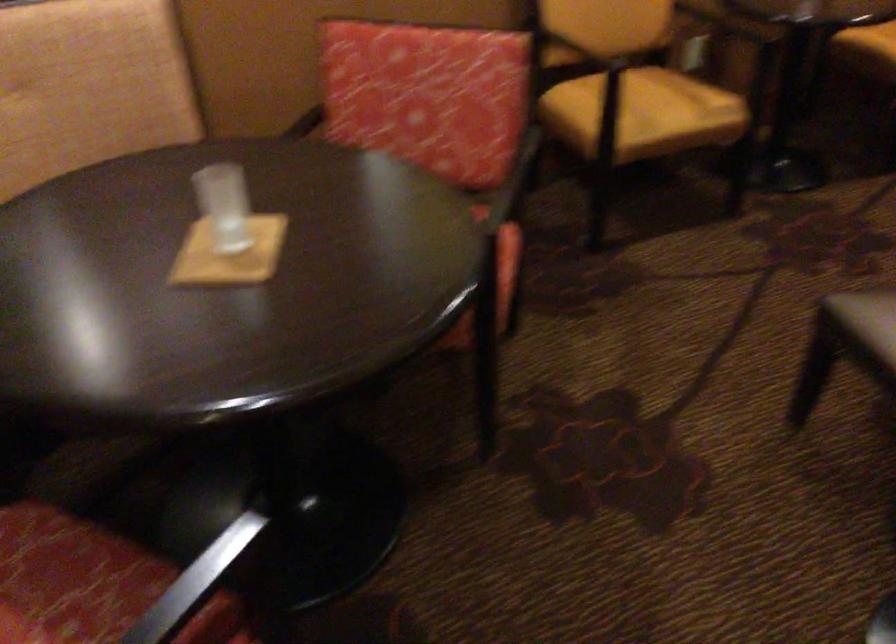
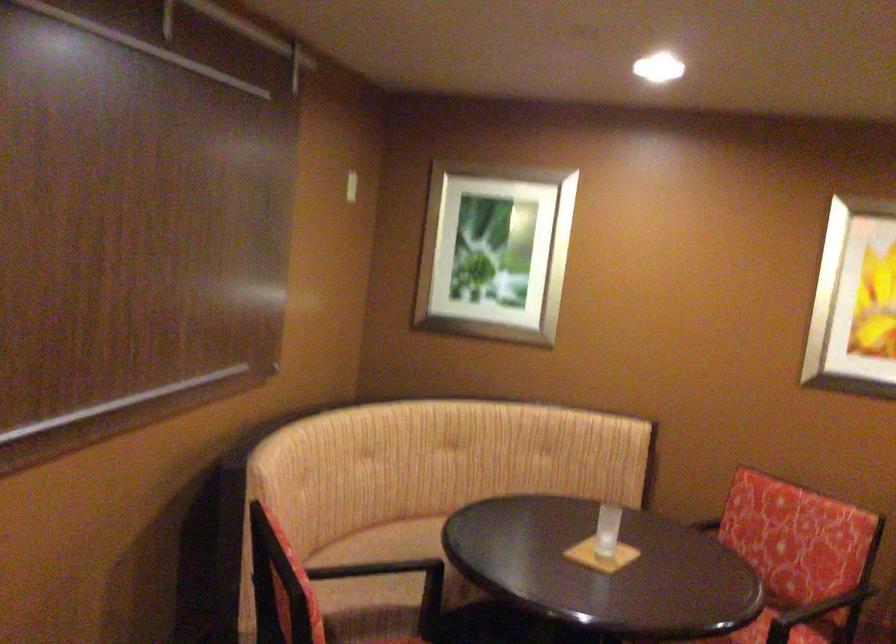
Locate, in the second image, the point that corresponds to (x=485, y=219) in the first image.

(779, 630)